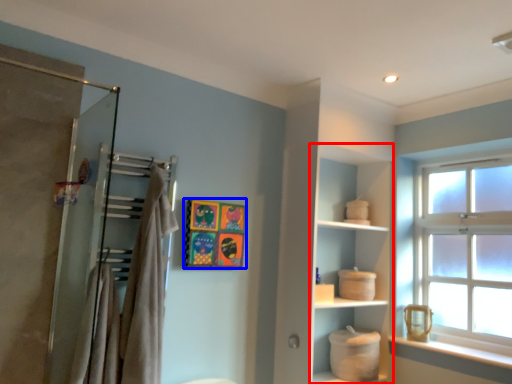
Question: Which object appears closest to the camera in this image, cabinet (highlighted by a red box) or picture frame (highlighted by a blue box)?

Choices:
 (A) cabinet
 (B) picture frame

Answer: (B)